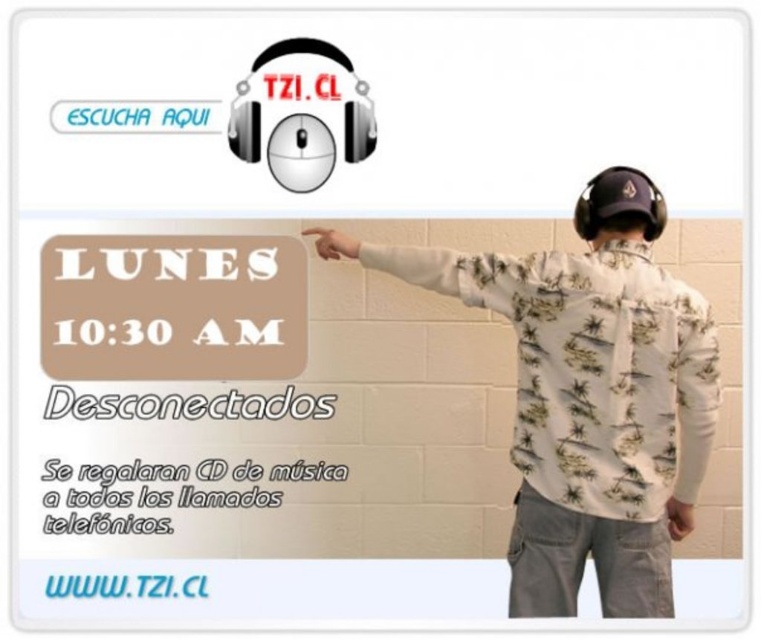
Question: Is the position of black matte headphones at upper center more distant than that of light beige skin at upper center?

Choices:
 (A) yes
 (B) no

Answer: (B)

Question: Can you confirm if white floral shirt at center is positioned to the left of light brown leather hand at lower right?

Choices:
 (A) yes
 (B) no

Answer: (A)

Question: Among these points, which one is farthest from the camera?

Choices:
 (A) (680, 518)
 (B) (269, 116)
 (C) (626, 385)

Answer: (B)

Question: Which point is closer to the camera?

Choices:
 (A) white floral shirt at center
 (B) light beige skin at upper center

Answer: (A)

Question: Which point is farther from the camera taking this photo?

Choices:
 (A) (311, 234)
 (B) (545, 540)
 (C) (361, 154)
 (D) (683, 536)

Answer: (A)

Question: Does light beige skin at upper center lie in front of light brown leather hand at lower right?

Choices:
 (A) no
 (B) yes

Answer: (A)